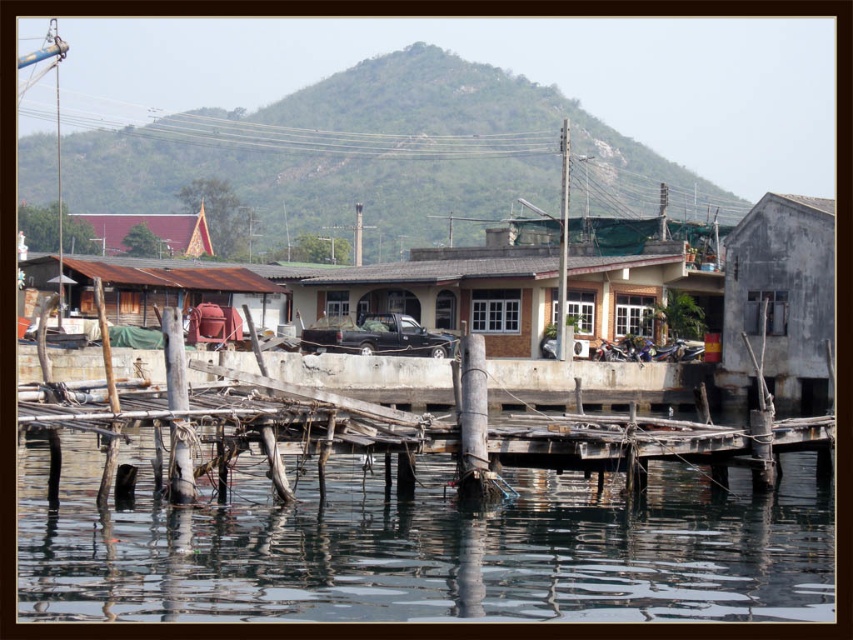
Measure the distance between point (544, 449) and camera.

They are 42.22 meters apart.

Who is positioned more to the left, weathered wood dock at center or rusty wood hut at left?

From the viewer's perspective, rusty wood hut at left appears more on the left side.

Who is more forward, [515,380] or [254,321]?

Point [515,380] is more forward.

Image resolution: width=853 pixels, height=640 pixels. Identify the location of weathered wood dock at center. (402, 416).

Between brown textured hut at center and gray concrete hut at right, which one has less height?

brown textured hut at center is shorter.

Where is `brown textured hut at center`? Image resolution: width=853 pixels, height=640 pixels. brown textured hut at center is located at coordinates (451, 289).

Who is more distant from viewer, (x=788, y=372) or (x=161, y=227)?

The point (x=161, y=227) is behind.

Does gray concrete hut at right appear under matte red tent at upper center?

Indeed, gray concrete hut at right is positioned under matte red tent at upper center.

Is point (813, 234) closer to camera compared to point (155, 212)?

Yes, point (813, 234) is in front of point (155, 212).

Locate an element on the screen. gray concrete hut at right is located at coordinates (780, 300).